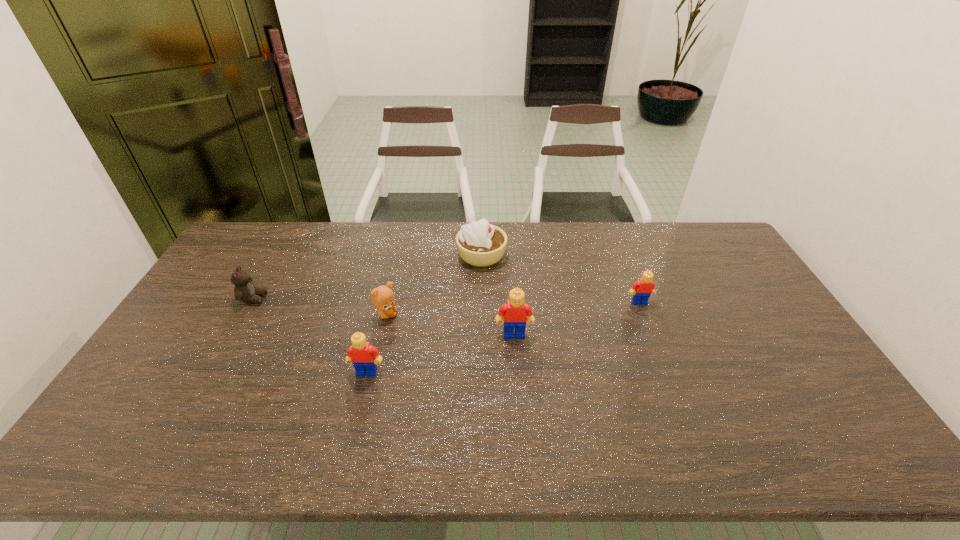
Where is `vacant space located 0.050m on the face of the second nearest Lego`? This screenshot has height=540, width=960. vacant space located 0.050m on the face of the second nearest Lego is located at coordinates (516, 353).

The image size is (960, 540). Identify the location of vacant point located 0.300m on the face of the rightmost Lego. (672, 386).

Find the location of a particular element. Image resolution: width=960 pixels, height=540 pixels. vacant region located on the left of the farthest object is located at coordinates (412, 255).

Find the location of a particular element. vacant space located on the face of the left teddy bear is located at coordinates (375, 299).

You are a GUI agent. You are given a task and a screenshot of the screen. Output one action in this format:
    pyautogui.click(x=<x>, y=<y>)
    Task: Click on the vacant space located 0.050m on the face of the right teddy bear
    This screenshot has width=960, height=540.
    Given the screenshot: What is the action you would take?
    pyautogui.click(x=414, y=315)

Locate an element on the screen. Image resolution: width=960 pixels, height=540 pixels. object that is positioned at the far edge is located at coordinates (481, 244).

Identify the location of object present at the left edge. (244, 290).

Where is `blank space at the far edge of the desktop`? Image resolution: width=960 pixels, height=540 pixels. blank space at the far edge of the desktop is located at coordinates (358, 226).

Find the location of a particular element. free space at the near edge of the desktop is located at coordinates (598, 407).

This screenshot has height=540, width=960. I want to click on blank space at the left edge of the desktop, so click(x=152, y=361).